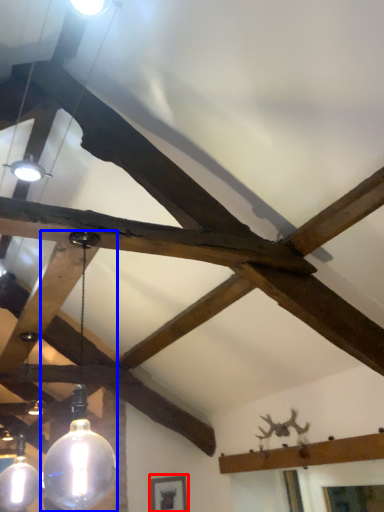
Question: Which object is further to the camera taking this photo, picture frame (highlighted by a red box) or lamp (highlighted by a blue box)?

Choices:
 (A) picture frame
 (B) lamp

Answer: (A)